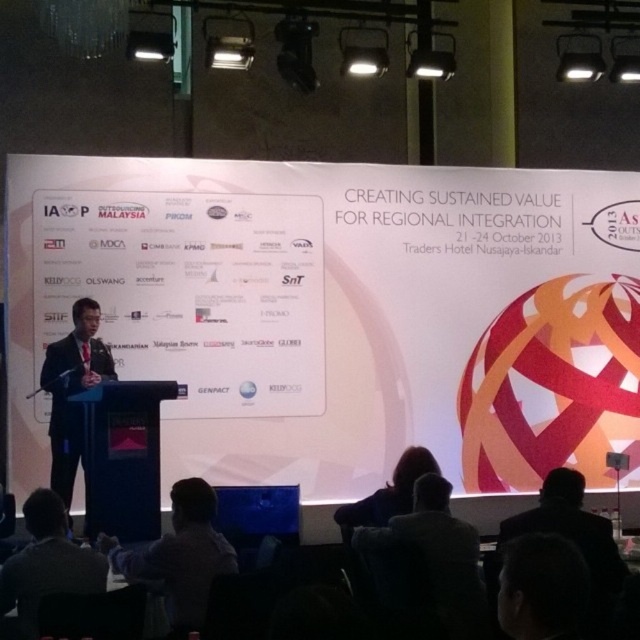
Based on the photo, you are an event organizer and need to determine seating arrangements based on the attendees in the image. Which attendee, the dark gray suit at lower left or the black suit at left, would require a smaller chair size?

The dark gray suit at lower left occupies less space than the black suit at left, so the dark gray suit at lower left would require a smaller chair size.

You are attending a formal event and notice two men in suits. One is wearing a dark gray suit at lower left and the other a black suit at left. From your perspective, which man is closer to the entrance of the event venue?

The dark gray suit at lower left is closer to the entrance because it is positioned in front of the black suit at left, indicating it is nearer to the viewer.

In the scene shown: You are an attendee at the event and want to know which suit is closer to the podium. The dark gray suit at lower left and the black suit at left are both in your line of sight. Which one is positioned closer to the podium?

The dark gray suit at lower left is to the right of black suit at left, so the black suit at left is closer to the podium since it is positioned to the left of the dark gray suit.